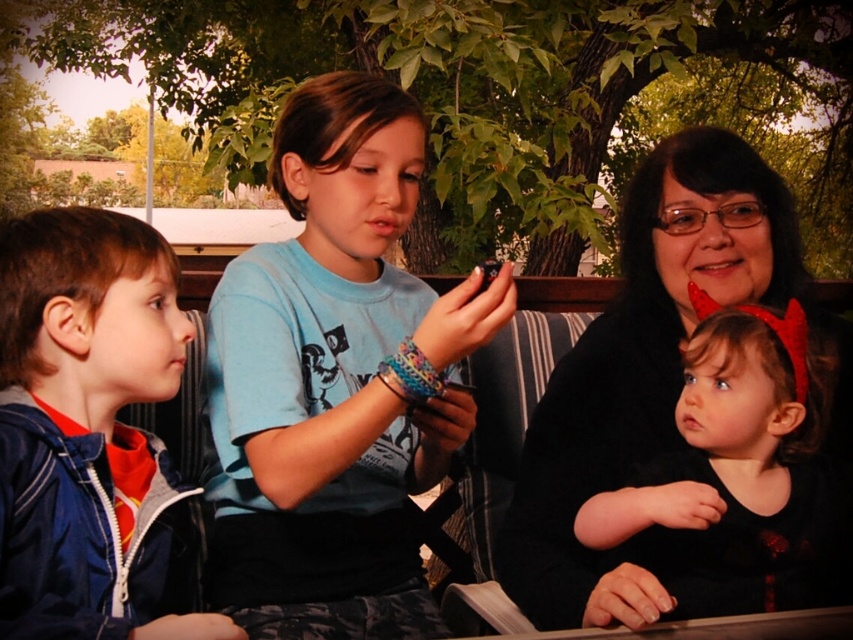
Can you confirm if blue denim jacket at left is wider than black matte hair at upper right?

In fact, blue denim jacket at left might be narrower than black matte hair at upper right.

Is blue denim jacket at left shorter than black matte hair at upper right?

Correct, blue denim jacket at left is not as tall as black matte hair at upper right.

Who is more distant from viewer, (80, 432) or (651, 413)?

The point (651, 413) is more distant.

Locate an element on the screen. blue denim jacket at left is located at coordinates (90, 429).

Measure the distance between blue t-shirt at center and camera.

The distance of blue t-shirt at center from camera is 1.04 meters.

The image size is (853, 640). What are the coordinates of `blue t-shirt at center` in the screenshot? It's located at (335, 380).

Measure the distance between blue t-shirt at center and blue denim jacket at left.

blue t-shirt at center is 10.07 inches away from blue denim jacket at left.

Consider the image. Between blue t-shirt at center and blue denim jacket at left, which one has less height?

Standing shorter between the two is blue denim jacket at left.

Is point (219, 556) positioned in front of point (30, 636)?

No, (219, 556) is behind (30, 636).

This screenshot has width=853, height=640. I want to click on blue t-shirt at center, so click(x=335, y=380).